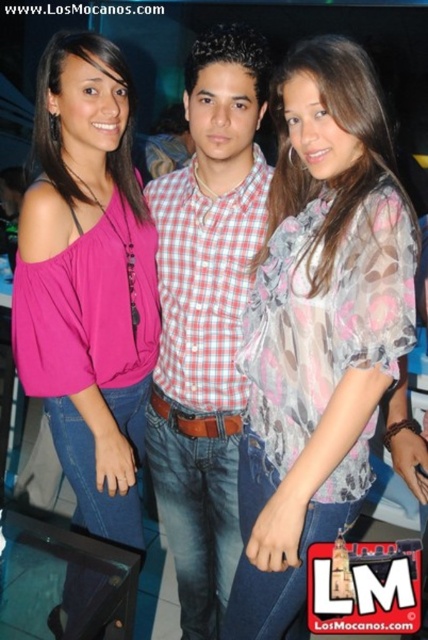
Question: Estimate the real-world distances between objects in this image. Which object is closer to the checkered fabric shirt at center?

Choices:
 (A) pink matte top at left
 (B) translucent floral blouse at center

Answer: (A)

Question: Which point is farther to the camera?

Choices:
 (A) (253, 296)
 (B) (154, 208)

Answer: (B)

Question: In this image, where is pink matte top at left located relative to checkered fabric shirt at center?

Choices:
 (A) above
 (B) below

Answer: (A)

Question: Is pink matte top at left positioned before checkered fabric shirt at center?

Choices:
 (A) yes
 (B) no

Answer: (B)

Question: Considering the real-world distances, which object is closest to the translucent floral blouse at center?

Choices:
 (A) checkered fabric shirt at center
 (B) pink matte top at left

Answer: (A)

Question: Does translucent floral blouse at center appear on the right side of pink matte top at left?

Choices:
 (A) no
 (B) yes

Answer: (B)